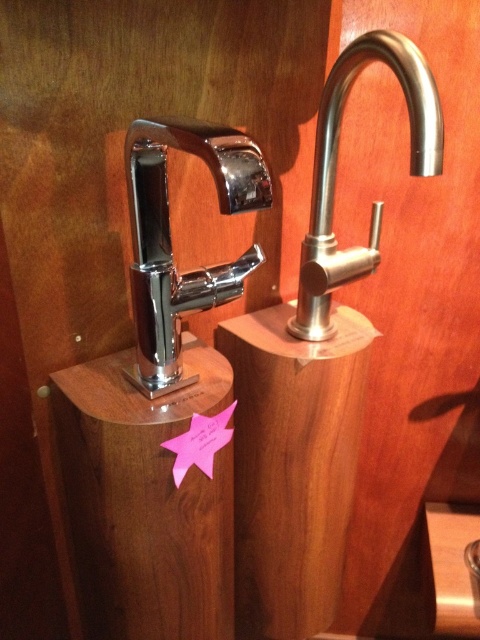
Can you confirm if wooden pedestal at center is positioned below polished stainless steel faucet at upper right?

Indeed, wooden pedestal at center is positioned under polished stainless steel faucet at upper right.

Which is in front, point (216, 566) or point (388, 49)?

Point (388, 49) is in front.

Locate an element on the screen. The width and height of the screenshot is (480, 640). wooden pedestal at center is located at coordinates (145, 500).

The image size is (480, 640). What do you see at coordinates (145, 500) in the screenshot? I see `wooden pedestal at center` at bounding box center [145, 500].

Does point (222, 618) lie in front of point (232, 298)?

No, it is not.

Which is in front, point (95, 388) or point (149, 305)?

Point (149, 305)

The width and height of the screenshot is (480, 640). What are the coordinates of `wooden pedestal at center` in the screenshot? It's located at (145, 500).

You are a GUI agent. You are given a task and a screenshot of the screen. Output one action in this format:
    pyautogui.click(x=<x>, y=<y>)
    Task: Click on the polished chrome faucet at center
    This screenshot has width=480, height=640.
    Given the screenshot: What is the action you would take?
    pyautogui.click(x=169, y=236)

Which is behind, point (261, 260) or point (357, 248)?

Point (357, 248)

Does point (154, 332) come behind point (404, 67)?

Yes, point (154, 332) is farther from viewer.

I want to click on polished chrome faucet at center, so click(x=169, y=236).